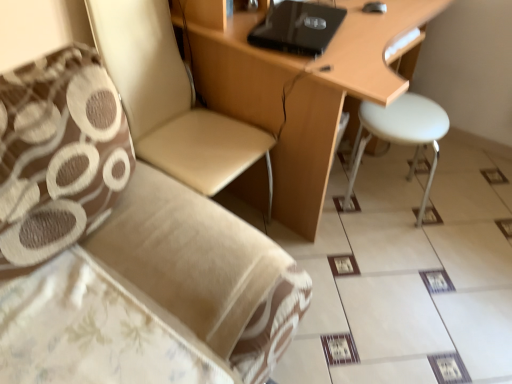
The width and height of the screenshot is (512, 384). Identify the location of white plastic stool at right. (401, 134).

What do you see at coordinates (337, 104) in the screenshot? I see `light brown wood desk at center` at bounding box center [337, 104].

What is the approximate height of black matte laptop at upper center?

black matte laptop at upper center is 2.11 inches in height.

The width and height of the screenshot is (512, 384). Identify the location of brown textured pillow at left. (58, 155).

How much distance is there between light brown wood desk at center and white plastic stool at right?

light brown wood desk at center is 16.61 inches from white plastic stool at right.

Is light brown wood desk at center outside of white plastic stool at right?

light brown wood desk at center lies outside white plastic stool at right's area.

From a real-world perspective, is light brown wood desk at center above or below white plastic stool at right?

In terms of real-world spatial position, light brown wood desk at center is above white plastic stool at right.

Does point (239, 29) come farther from viewer compared to point (381, 117)?

No.

Does brown textured pillow at left have a greater height compared to black matte laptop at upper center?

Indeed, brown textured pillow at left has a greater height compared to black matte laptop at upper center.

Considering the points (96, 85) and (346, 10), which point is in front, point (96, 85) or point (346, 10)?

The point (96, 85) is closer to the camera.

Find the location of a particular element. pillow that is on the left side of black matte laptop at upper center is located at coordinates (58, 155).

Looking at the image, does brown textured pillow at left seem bigger or smaller compared to black matte laptop at upper center?

Clearly, brown textured pillow at left is larger in size than black matte laptop at upper center.

Considering the sizes of objects black matte laptop at upper center and white plastic stool at right in the image provided, who is bigger, black matte laptop at upper center or white plastic stool at right?

white plastic stool at right.

Does black matte laptop at upper center appear on the left side of white plastic stool at right?

Indeed, black matte laptop at upper center is positioned on the left side of white plastic stool at right.

Is black matte laptop at upper center directly adjacent to white plastic stool at right?

No, black matte laptop at upper center is not touching white plastic stool at right.

Is black matte laptop at upper center not near light brown wood desk at center?

No, there isn't a large distance between black matte laptop at upper center and light brown wood desk at center.

How different are the orientations of black matte laptop at upper center and light brown wood desk at center in degrees?

18.7 degrees.

From a real-world perspective, who is located higher, black matte laptop at upper center or light brown wood desk at center?

A: From a 3D spatial view, black matte laptop at upper center is above.

Considering the positions of point (311, 42) and point (341, 87), is point (311, 42) closer or farther from the camera than point (341, 87)?

Point (311, 42) is farther from the camera than point (341, 87).

Is brown textured pillow at left with beige fabric chair at upper left?

brown textured pillow at left and beige fabric chair at upper left are clearly separated.

Could you tell me if brown textured pillow at left is turned towards beige fabric chair at upper left?

No, brown textured pillow at left does not turn towards beige fabric chair at upper left.

Can you confirm if brown textured pillow at left is wider than beige fabric chair at upper left?

No, brown textured pillow at left is not wider than beige fabric chair at upper left.

Between white plastic stool at right and light brown wood desk at center, which one has smaller size?

With smaller size is white plastic stool at right.

The width and height of the screenshot is (512, 384). In order to click on stool below the light brown wood desk at center (from a real-world perspective) in this screenshot , I will do `click(401, 134)`.

Can you confirm if white plastic stool at right is taller than light brown wood desk at center?

No.

Locate an element on the screen. The height and width of the screenshot is (384, 512). chair on the left of black matte laptop at upper center is located at coordinates (170, 100).

From a real-world perspective, which object stands above the other?

black matte laptop at upper center is physically above.

Considering the sizes of objects black matte laptop at upper center and beige fabric chair at upper left in the image provided, who is thinner, black matte laptop at upper center or beige fabric chair at upper left?

With smaller width is black matte laptop at upper center.

How far apart are black matte laptop at upper center and beige fabric chair at upper left?

black matte laptop at upper center is 15.48 inches away from beige fabric chair at upper left.

Locate an element on the screen. This screenshot has width=512, height=384. stool on the right side of light brown wood desk at center is located at coordinates (401, 134).

In order to click on pillow below the black matte laptop at upper center (from the image's perspective) in this screenshot , I will do `click(58, 155)`.

Which object lies further to the anchor point black matte laptop at upper center, light brown wood desk at center or beige fabric chair at upper left?

beige fabric chair at upper left is positioned further to the anchor black matte laptop at upper center.

When comparing their distances from light brown wood desk at center, does white plastic stool at right or black matte laptop at upper center seem closer?

black matte laptop at upper center.

When comparing their distances from beige fabric chair at upper left, does black matte laptop at upper center or white plastic stool at right seem closer?

black matte laptop at upper center is closer to beige fabric chair at upper left.

Which object lies further to the anchor point brown textured pillow at left, light brown wood desk at center or black matte laptop at upper center?

black matte laptop at upper center is further to brown textured pillow at left.

Based on their spatial positions, is black matte laptop at upper center or light brown wood desk at center closer to brown textured pillow at left?

light brown wood desk at center is positioned closer to the anchor brown textured pillow at left.

Based on their spatial positions, is brown textured pillow at left or black matte laptop at upper center closer to white plastic stool at right?

The object closer to white plastic stool at right is black matte laptop at upper center.

When comparing their distances from brown textured pillow at left, does white plastic stool at right or beige fabric chair at upper left seem further?

white plastic stool at right lies further to brown textured pillow at left than the other object.

Which object lies further to the anchor point beige fabric chair at upper left, brown textured pillow at left or black matte laptop at upper center?

Among the two, brown textured pillow at left is located further to beige fabric chair at upper left.

You are a GUI agent. You are given a task and a screenshot of the screen. Output one action in this format:
    pyautogui.click(x=<x>, y=<y>)
    Task: Click on the laptop located between brown textured pillow at left and light brown wood desk at center in the left-right direction
    This screenshot has height=384, width=512.
    Given the screenshot: What is the action you would take?
    (x=297, y=27)

I want to click on chair situated between brown textured pillow at left and black matte laptop at upper center from left to right, so click(170, 100).

Locate an element on the screen. laptop between brown textured pillow at left and white plastic stool at right from left to right is located at coordinates (297, 27).

At what (x,y) coordinates should I click in order to perform the action: click on desk between beige fabric chair at upper left and white plastic stool at right in the horizontal direction. Please return your answer as a coordinate pair (x, y). This screenshot has width=512, height=384. Looking at the image, I should click on (337, 104).